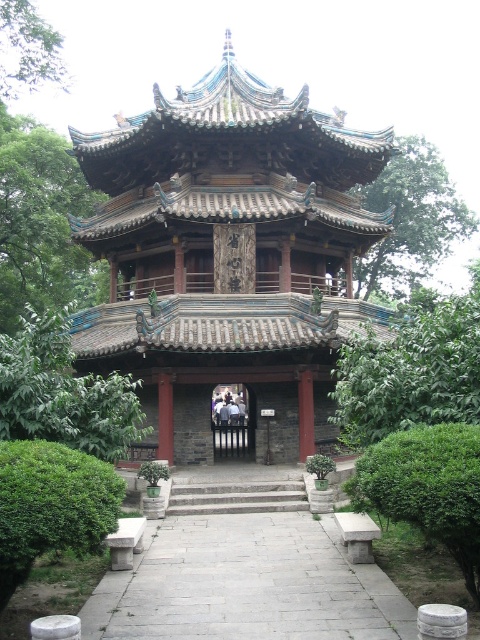
You are a visitor approaching the traditional Chinese pavilion and need to reach the entrance. There is a gray stone path at center and stone steps at center in your way. Which path should you take to reach the entrance more easily?

The gray stone path at center is larger in size than the stone steps at center, so it would be easier to walk on the gray stone path at center to reach the entrance more easily.